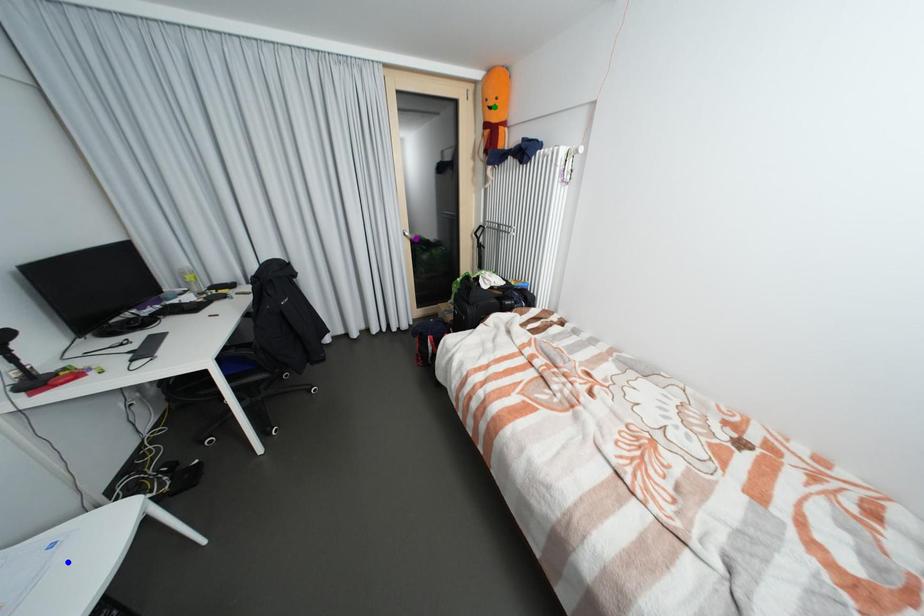
Order these from nearest to farthest:
1. blue point
2. green point
3. purple point

1. blue point
2. green point
3. purple point